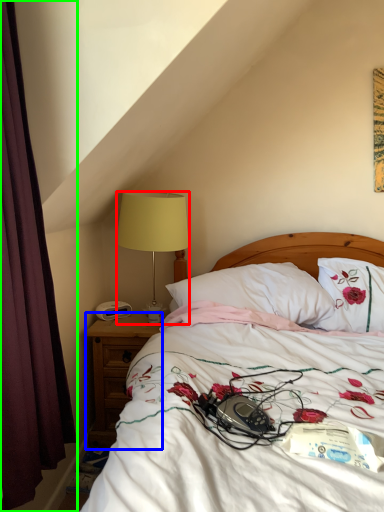
Question: Estimate the real-world distances between objects in this image. Which object is farther from lamp (highlighted by a red box), nightstand (highlighted by a blue box) or curtain (highlighted by a green box)?

Choices:
 (A) nightstand
 (B) curtain

Answer: (B)